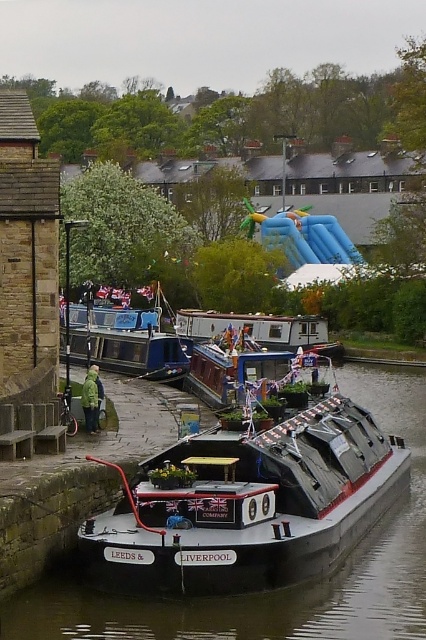
Question: Is black polished barge at center closer to camera compared to green matte jacket at lower left?

Choices:
 (A) yes
 (B) no

Answer: (A)

Question: Which point is farther from the camera taking this photo?

Choices:
 (A) (178, 321)
 (B) (95, 358)
 (C) (86, 387)
 (D) (175, 454)

Answer: (A)

Question: Is blue rubber slide at upper center positioned behind green matte jacket at lower left?

Choices:
 (A) no
 (B) yes

Answer: (B)

Question: Is the position of black polished barge at center more distant than that of white glossy canal boat at center?

Choices:
 (A) yes
 (B) no

Answer: (B)

Question: Which of the following is the closest to the observer?

Choices:
 (A) (233, 396)
 (B) (118, 516)

Answer: (B)

Question: Which object is the farthest from the blue rubber slide at upper center?

Choices:
 (A) matte blue boat at center
 (B) black polished barge at center
 (C) white glossy canal boat at center

Answer: (B)